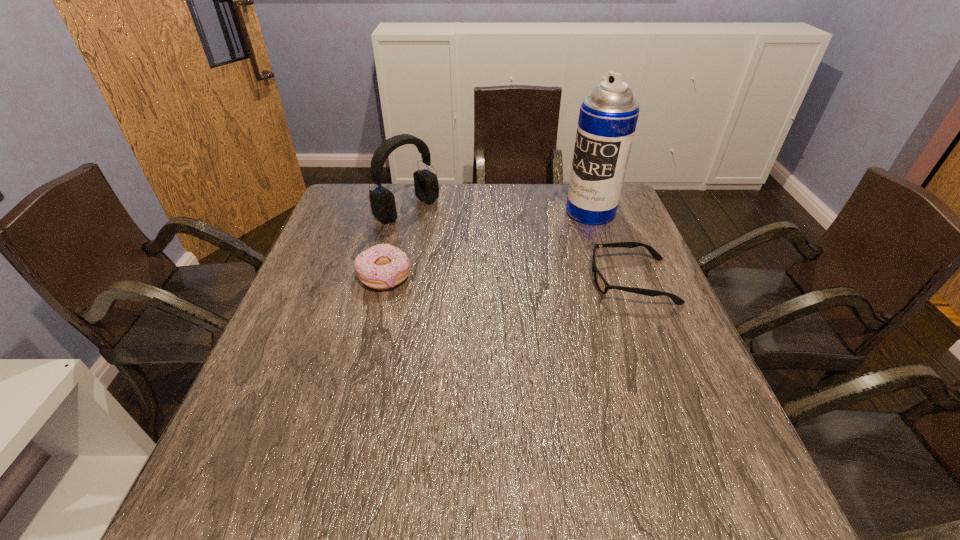
At what (x,y) coordinates should I click in order to perform the action: click on doughnut. Please return your answer as a coordinate pair (x, y). Image resolution: width=960 pixels, height=540 pixels. Looking at the image, I should click on (383, 266).

Locate an element on the screen. Image resolution: width=960 pixels, height=540 pixels. spectacles is located at coordinates (602, 285).

Where is `headset`? headset is located at coordinates (382, 200).

Where is `aerosol can`? aerosol can is located at coordinates (608, 116).

At what (x,y) coordinates should I click in order to perform the action: click on vacant space located 0.280m on the right of the second shortest object. Please return your answer as a coordinate pair (x, y). Image resolution: width=960 pixels, height=540 pixels. Looking at the image, I should click on (519, 276).

Find the location of a particular element. The image size is (960, 540). free space located on the front-facing side of the spectacles is located at coordinates (434, 281).

At what (x,y) coordinates should I click in order to perform the action: click on free spot located on the front-facing side of the spectacles. Please return your answer as a coordinate pair (x, y). The height and width of the screenshot is (540, 960). Looking at the image, I should click on (544, 281).

Where is `blank space located 0.050m on the front-facing side of the spectacles`? blank space located 0.050m on the front-facing side of the spectacles is located at coordinates (571, 281).

I want to click on vacant region located 0.120m on the headband of the third shortest object, so click(x=454, y=239).

Identify the location of free location located 0.120m on the headband of the third shortest object. (454, 239).